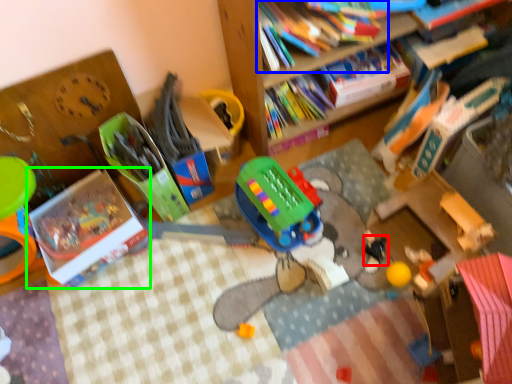
Question: Which is nearer to the toy (highlighted by a red box)? book (highlighted by a blue box) or book (highlighted by a green box).

Choices:
 (A) book
 (B) book

Answer: (A)